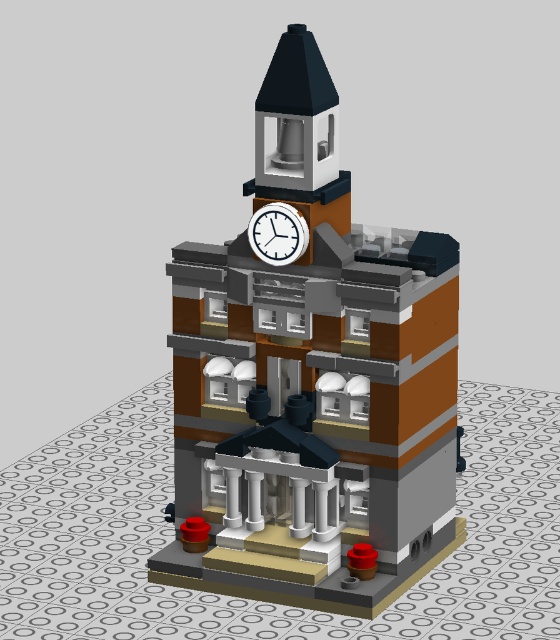
I want to click on brick tower at center, so point(312,380).

Can you confirm if brick tower at center is thinner than white plastic clock at upper center?

No, brick tower at center is not thinner than white plastic clock at upper center.

Between point (339, 266) and point (272, 227), which one is positioned in front?

Point (339, 266) is in front.

Where is `brick tower at center`? The height and width of the screenshot is (640, 560). brick tower at center is located at coordinates (312, 380).